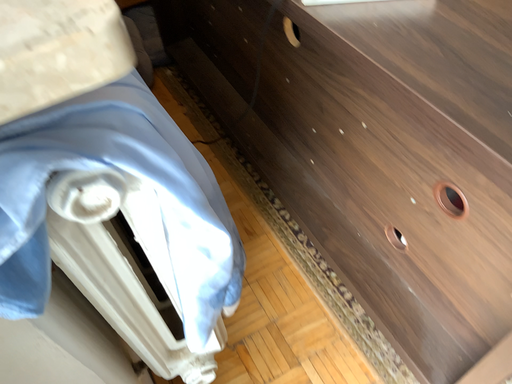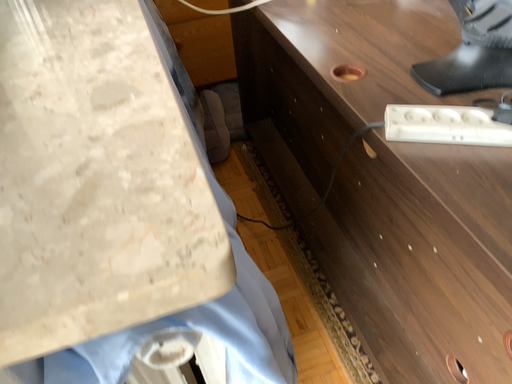
Question: How did the camera likely rotate when shooting the video?

Choices:
 (A) rotated downward
 (B) rotated upward

Answer: (B)